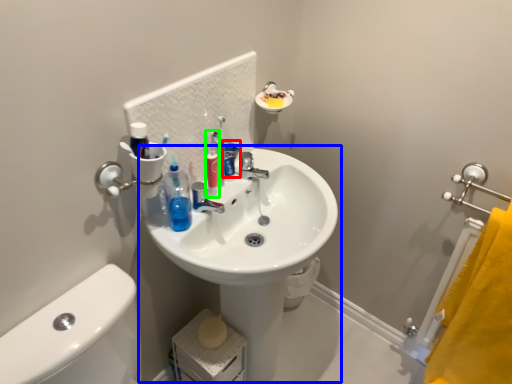
Question: Considering the real-world distances, which object is farthest from toothpaste (highlighted by a red box)? sink (highlighted by a blue box) or cleaning product (highlighted by a green box)?

Choices:
 (A) sink
 (B) cleaning product

Answer: (A)